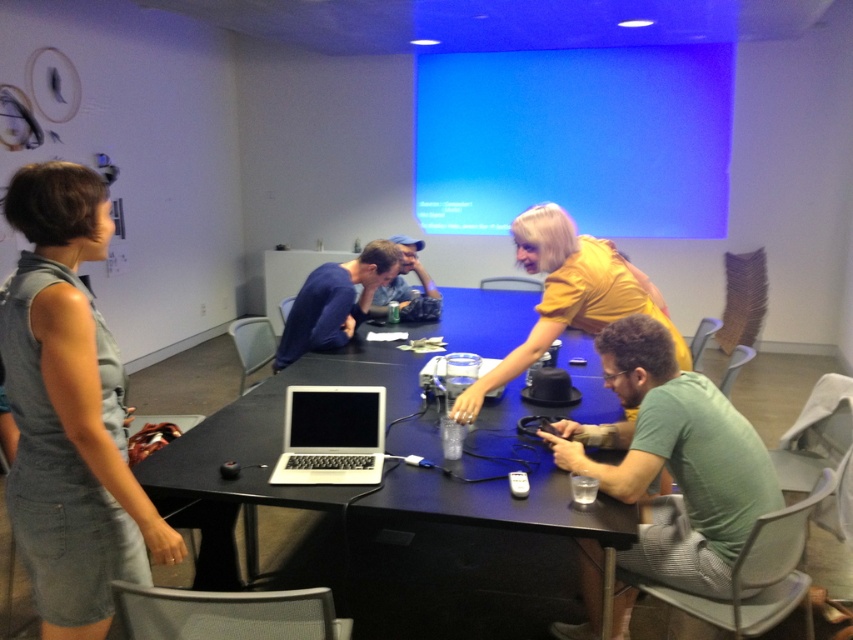
This screenshot has width=853, height=640. Identify the location of black plastic table at center. (361, 486).

The width and height of the screenshot is (853, 640). Describe the element at coordinates (361, 486) in the screenshot. I see `black plastic table at center` at that location.

Is point (177, 477) more distant than point (300, 452)?

No, (177, 477) is closer to viewer.

You are a GUI agent. You are given a task and a screenshot of the screen. Output one action in this format:
    pyautogui.click(x=<x>, y=<y>)
    Task: Click on the black plastic table at center
    
    Given the screenshot: What is the action you would take?
    pyautogui.click(x=361, y=486)

Is point (247, 440) farther from viewer compared to point (41, 224)?

Yes, it is behind point (41, 224).

Between point (274, 456) and point (96, 534), which one is positioned in front?

Positioned in front is point (96, 534).

Locate an element on the screen. black plastic table at center is located at coordinates (361, 486).

What do you see at coordinates (672, 460) in the screenshot? I see `green matte shirt at lower right` at bounding box center [672, 460].

Who is lower down, green matte shirt at lower right or dark blue fabric shirt at center?

Positioned lower is green matte shirt at lower right.

Which is in front, point (590, 580) or point (317, 349)?

Positioned in front is point (590, 580).

Locate an element on the screen. Image resolution: width=853 pixels, height=640 pixels. green matte shirt at lower right is located at coordinates (672, 460).